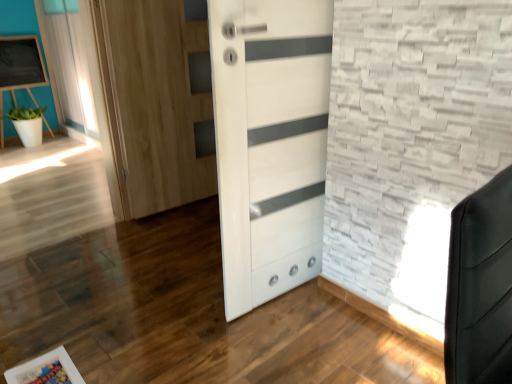
At what (x,y) coordinates should I click in order to perform the action: click on free space below wooden picture frame at lower left (from a real-world perspective). Please return your answer as a coordinate pair (x, y). Looking at the image, I should click on click(46, 372).